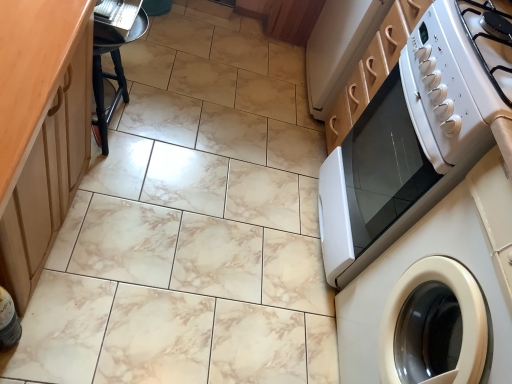
Question: From a real-world perspective, is wooden at left positioned over white glossy microwave at right based on gravity?

Choices:
 (A) yes
 (B) no

Answer: (A)

Question: From a real-world perspective, is wooden at left located beneath white glossy microwave at right?

Choices:
 (A) yes
 (B) no

Answer: (B)

Question: Is wooden at left oriented towards white glossy microwave at right?

Choices:
 (A) yes
 (B) no

Answer: (A)

Question: From the image's perspective, is wooden at left on white glossy microwave at right?

Choices:
 (A) yes
 (B) no

Answer: (A)

Question: From the image's perspective, does wooden at left appear lower than white glossy microwave at right?

Choices:
 (A) yes
 (B) no

Answer: (B)

Question: Does wooden at left have a lesser width compared to white glossy microwave at right?

Choices:
 (A) no
 (B) yes

Answer: (B)

Question: Is the position of black wood bar stool at left less distant than that of white glossy washing machine at right?

Choices:
 (A) yes
 (B) no

Answer: (B)

Question: From a real-world perspective, is black wood bar stool at left under white glossy washing machine at right?

Choices:
 (A) yes
 (B) no

Answer: (A)

Question: Does black wood bar stool at left have a lesser height compared to white glossy washing machine at right?

Choices:
 (A) no
 (B) yes

Answer: (B)

Question: From the image's perspective, is black wood bar stool at left below white glossy washing machine at right?

Choices:
 (A) yes
 (B) no

Answer: (B)

Question: Is black wood bar stool at left looking in the opposite direction of white glossy washing machine at right?

Choices:
 (A) yes
 (B) no

Answer: (B)

Question: Is the position of black wood bar stool at left more distant than that of white glossy washing machine at right?

Choices:
 (A) yes
 (B) no

Answer: (A)

Question: Is white glossy microwave at right in front of wooden at left?

Choices:
 (A) yes
 (B) no

Answer: (B)